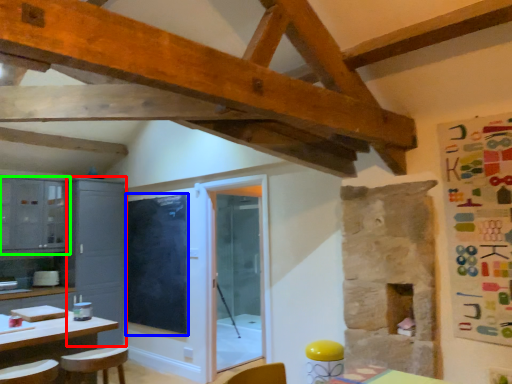
Question: Based on their relative distances, which object is farther from cabinetry (highlighted by a red box)? Choose from window screen (highlighted by a blue box) and cabinetry (highlighted by a green box).

Choices:
 (A) window screen
 (B) cabinetry

Answer: (B)